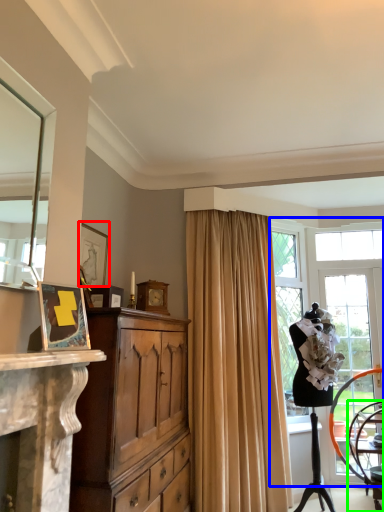
Question: Considering the real-world distances, which object is farthest from picture frame (highlighted by a red box)? window (highlighted by a blue box) or chair (highlighted by a green box)?

Choices:
 (A) window
 (B) chair

Answer: (B)